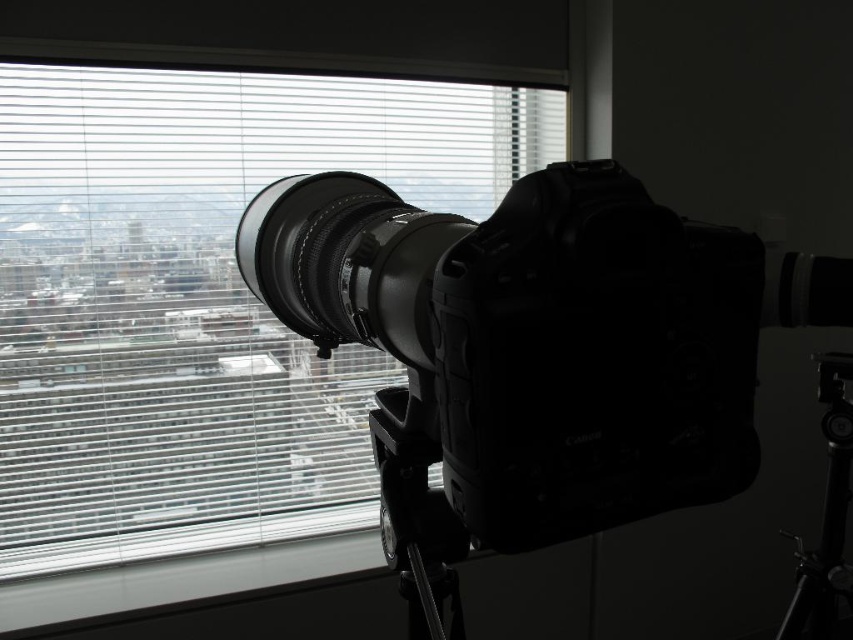
Describe the element at coordinates (200, 298) in the screenshot. I see `white matte blinds at upper center` at that location.

Which is in front, point (12, 499) or point (726, 282)?

Point (726, 282)

Identify the location of white matte blinds at upper center. (200, 298).

Can you confirm if white matte blinds at upper center is smaller than black metal tripod at lower right?

No, white matte blinds at upper center is not smaller than black metal tripod at lower right.

Is point (199, 483) behind point (845, 417)?

Yes, it is behind point (845, 417).

Is point (302, 374) behind point (834, 595)?

That is True.

What are the coordinates of `white matte blinds at upper center` in the screenshot? It's located at (200, 298).

Is black rubber lens at center taller than black metal tripod at lower right?

Incorrect, black rubber lens at center's height is not larger of black metal tripod at lower right's.

Is point (416, 346) more distant than point (850, 381)?

No, it is in front of (850, 381).

Which is in front, point (317, 300) or point (833, 566)?

Point (317, 300) is more forward.

This screenshot has width=853, height=640. Find the location of `black rubber lens at center`. black rubber lens at center is located at coordinates click(346, 260).